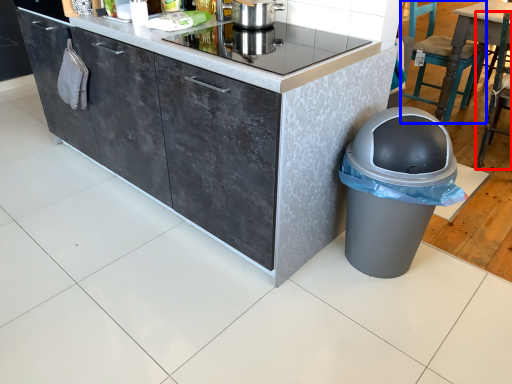
Question: Which point is closer to the camera, chair (highlighted by a red box) or chair (highlighted by a blue box)?

Choices:
 (A) chair
 (B) chair

Answer: (A)